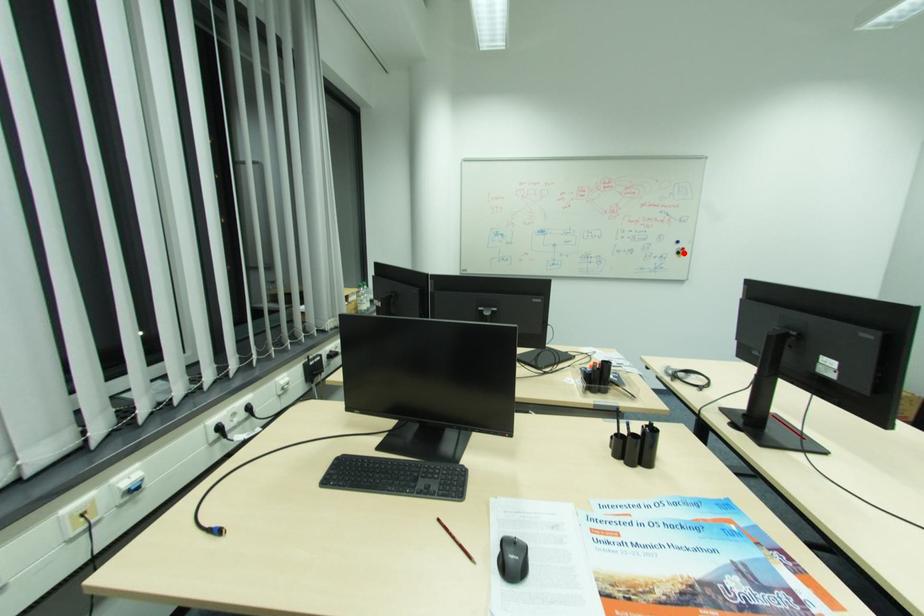
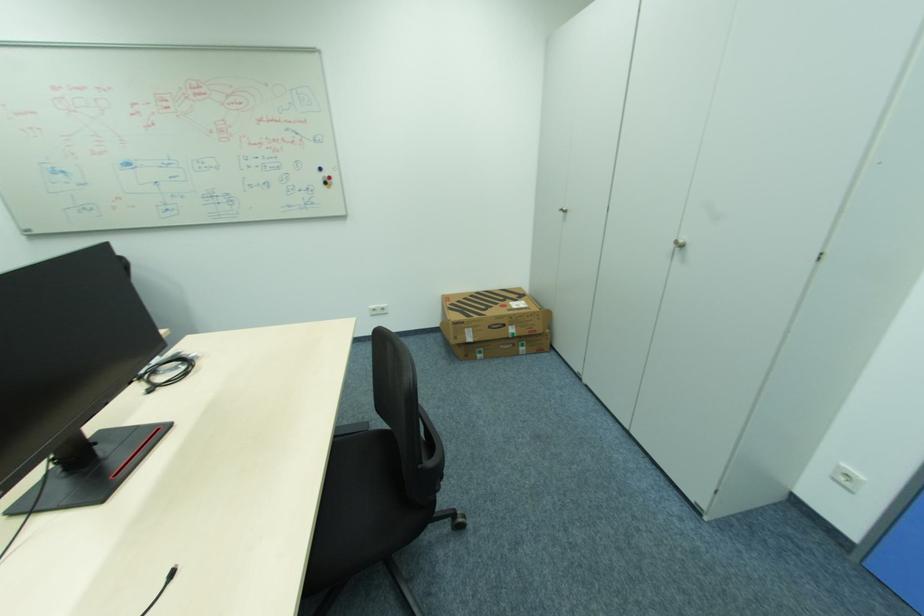
Find the pixel in the second image that matches the highlighted location in the first image.

(331, 184)